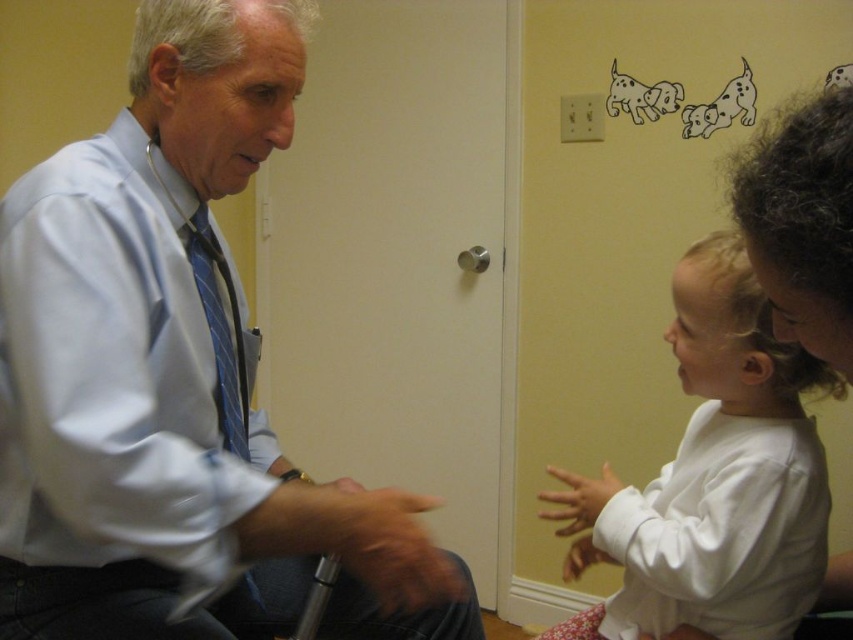
Can you confirm if light blue shirt at left is positioned to the right of white soft shirt at right?

Incorrect, light blue shirt at left is not on the right side of white soft shirt at right.

Does light blue shirt at left have a lesser width compared to white soft shirt at right?

No, light blue shirt at left is not thinner than white soft shirt at right.

Between point (125, 266) and point (746, 296), which one is positioned behind?

The point (746, 296) is behind.

Where is `light blue shirt at left`? light blue shirt at left is located at coordinates (173, 378).

Does light blue shirt at left have a greater height compared to blue striped tie at left?

Yes.

Which is behind, point (47, 477) or point (247, 385)?

The point (247, 385) is behind.

Identify the location of light blue shirt at left. (173, 378).

Which is above, light blue shirt at left or matte blue dress shirt at left?

matte blue dress shirt at left is higher up.

Between light blue shirt at left and matte blue dress shirt at left, which one has more height?

Standing taller between the two is light blue shirt at left.

Between point (137, 211) and point (73, 538), which one is positioned in front?

Positioned in front is point (137, 211).

Where is `light blue shirt at left`? The width and height of the screenshot is (853, 640). light blue shirt at left is located at coordinates (173, 378).